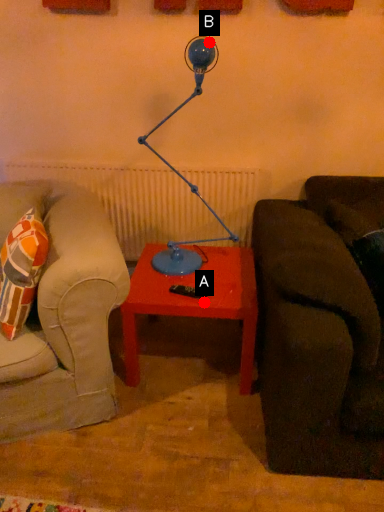
Question: Two points are circled on the image, labeled by A and B beside each circle. Which point is closer to the camera?

Choices:
 (A) A is closer
 (B) B is closer

Answer: (B)